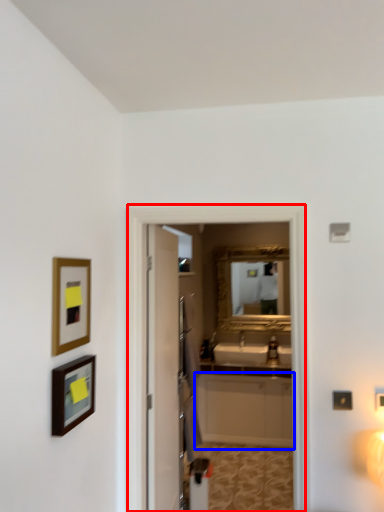
Question: Which object is closer to the camera taking this photo, screen door (highlighted by a red box) or cabinetry (highlighted by a blue box)?

Choices:
 (A) screen door
 (B) cabinetry

Answer: (A)